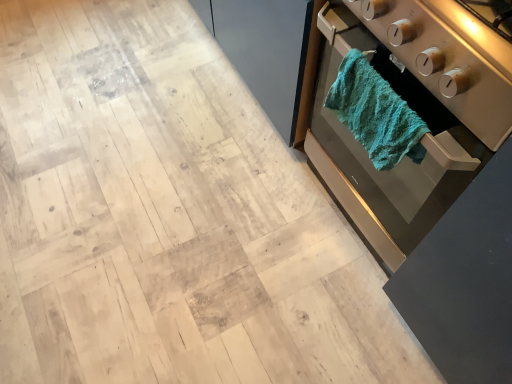
Question: Is teal textured towel at right wider or thinner than teal fabric towel at right?

Choices:
 (A) wide
 (B) thin

Answer: (B)

Question: In terms of height, does teal textured towel at right look taller or shorter compared to teal fabric towel at right?

Choices:
 (A) tall
 (B) short

Answer: (B)

Question: Which is nearer to the teal textured towel at right?

Choices:
 (A) teal fabric towel at right
 (B) teal fabric towel at right

Answer: (B)

Question: Considering the real-world distances, which object is farthest from the teal fabric towel at right?

Choices:
 (A) teal textured towel at right
 (B) teal fabric towel at right

Answer: (B)